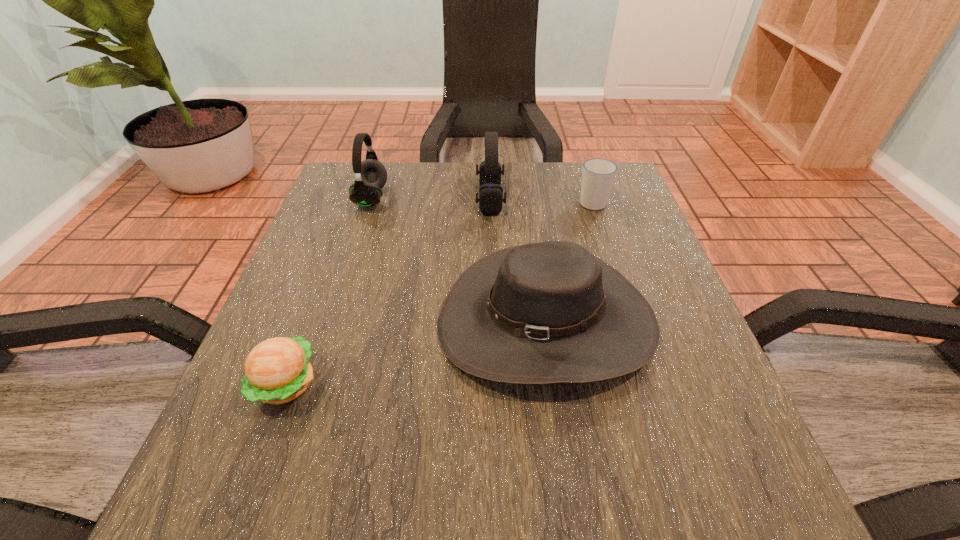
The image size is (960, 540). What are the coordinates of `vacant space that satisfies the following two spatial constraints: 1. with a handle on the side of the cup; 2. on the headband of the right headset` in the screenshot? It's located at [591, 199].